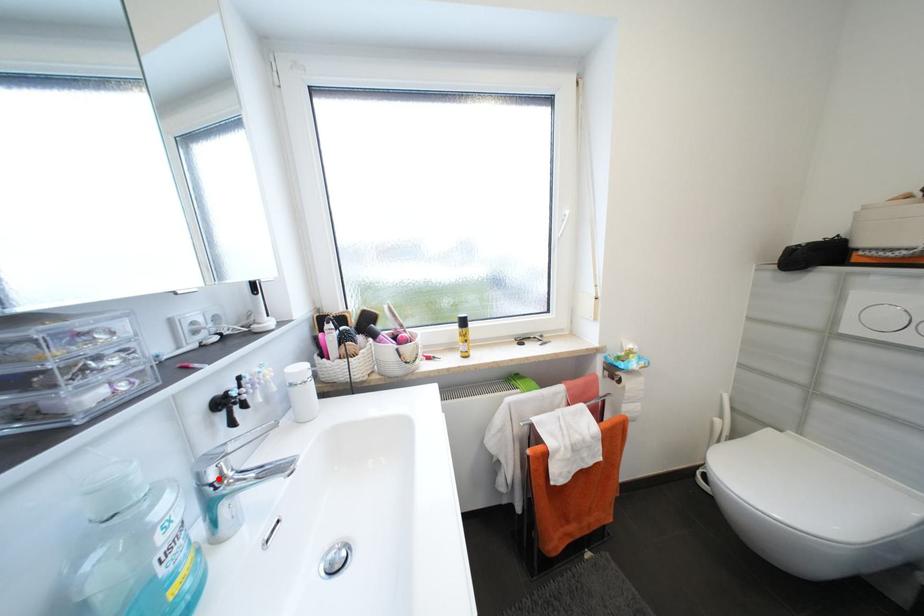
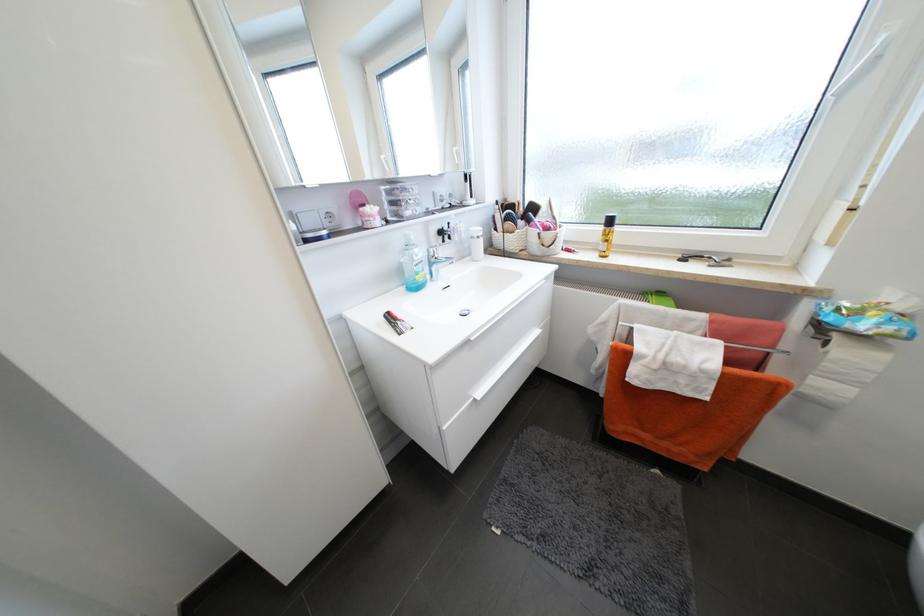
The point at the highlighted location is marked in the first image. Where is the corresponding point in the second image?

(438, 254)